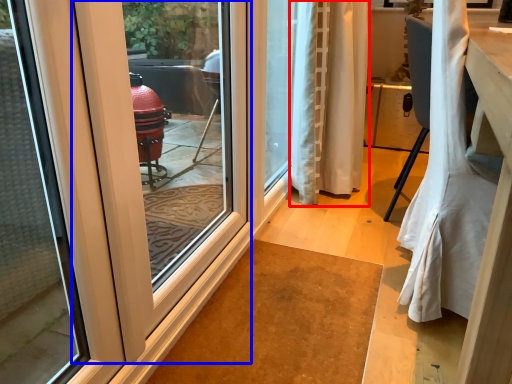
Question: Among these objects, which one is nearest to the camera, curtain (highlighted by a red box) or door (highlighted by a blue box)?

Choices:
 (A) curtain
 (B) door

Answer: (B)